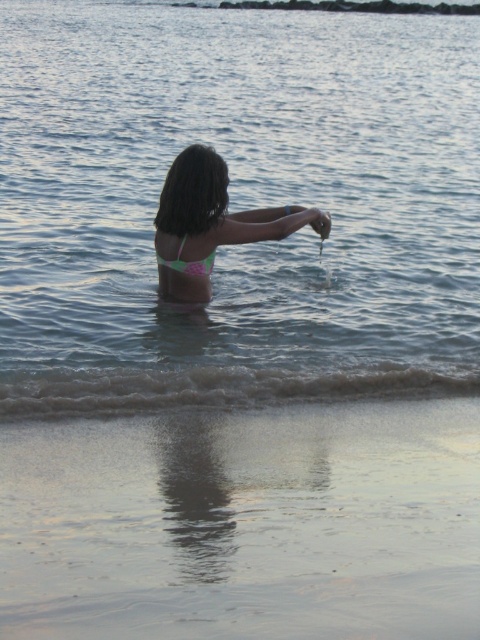
Consider the image. Who is more forward, (x=457, y=582) or (x=202, y=262)?

Point (x=457, y=582)

Which of these two, smooth sand at lower center or green matte bikini at center, stands taller?

smooth sand at lower center is taller.

The image size is (480, 640). In order to click on smooth sand at lower center in this screenshot , I will do `click(244, 524)`.

Looking at this image, who is taller, smooth sand at lower center or smooth skin hand at upper center?

smooth sand at lower center

Is smooth sand at lower center wider than smooth skin hand at upper center?

Yes, smooth sand at lower center is wider than smooth skin hand at upper center.

Who is more distant from viewer, (83, 449) or (322, 228)?

Point (322, 228)

The width and height of the screenshot is (480, 640). I want to click on smooth sand at lower center, so click(244, 524).

Which is below, pink bikini at center or smooth skin hand at upper center?

Positioned lower is pink bikini at center.

Does point (220, 173) lie in front of point (325, 216)?

Yes, point (220, 173) is in front of point (325, 216).

At what (x,y) coordinates should I click in order to perform the action: click on pink bikini at center. Please return your answer as a coordinate pair (x, y). Image resolution: width=480 pixels, height=640 pixels. Looking at the image, I should click on (206, 224).